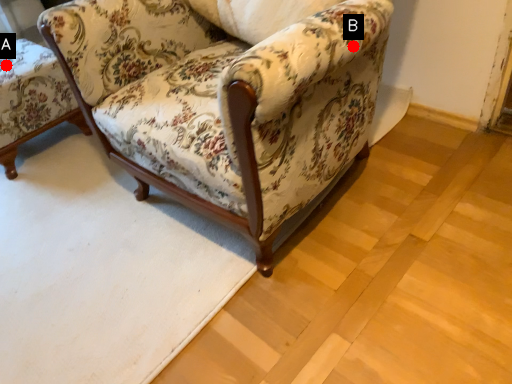
Question: Two points are circled on the image, labeled by A and B beside each circle. Which point appears closest to the camera in this image?

Choices:
 (A) A is closer
 (B) B is closer

Answer: (B)